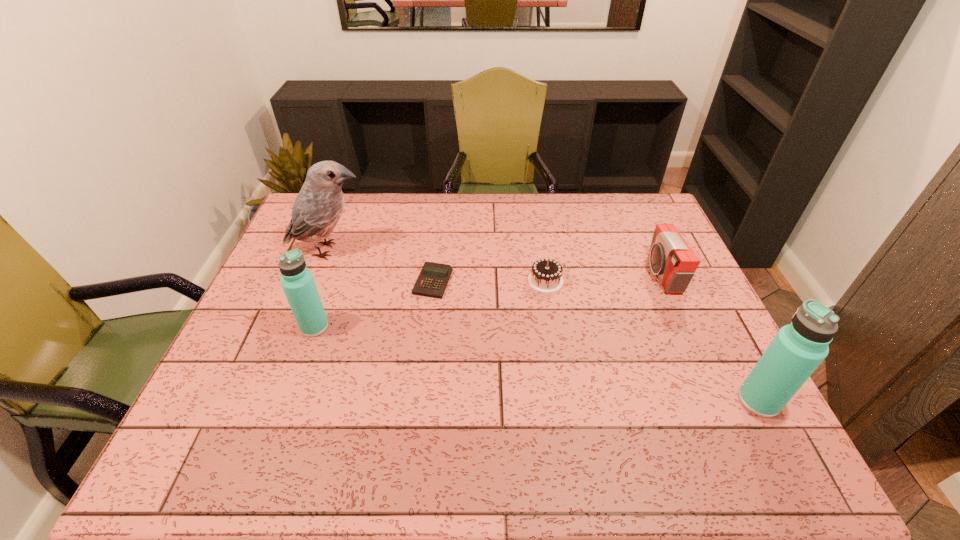
If we want them evenly spaced by inserting an extra thermos_bottle among them, please locate a free spot for this new thermos_bottle. Please provide its 2D coordinates. Your answer should be formatted as a tuple, i.e. [(x, y)], where the tuple contains the x and y coordinates of a point satisfying the conditions above.

[(520, 361)]